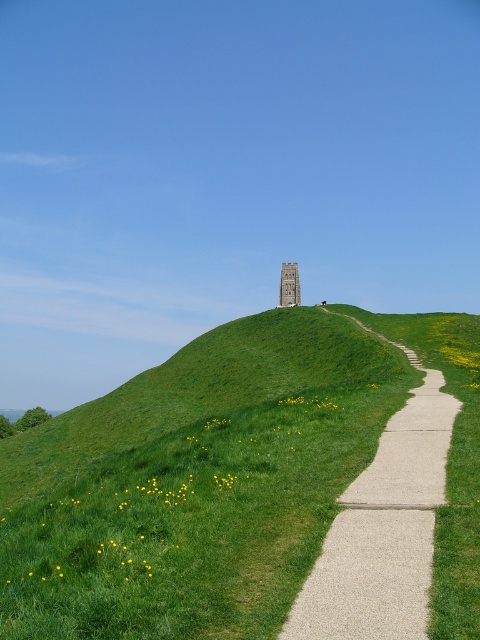
Question: Can you confirm if green grassy hill at center is bigger than stone tower at center?

Choices:
 (A) yes
 (B) no

Answer: (A)

Question: Among these points, which one is farthest from the camera?

Choices:
 (A) (432, 468)
 (B) (475, 600)

Answer: (A)

Question: Is light gray gravel path at center thinner than stone tower at center?

Choices:
 (A) yes
 (B) no

Answer: (B)

Question: Considering the real-world distances, which object is closest to the light gray gravel path at center?

Choices:
 (A) stone tower at center
 (B) green grassy hill at center

Answer: (B)

Question: Does light gray gravel path at center appear under stone tower at center?

Choices:
 (A) no
 (B) yes

Answer: (B)

Question: Considering the real-world distances, which object is closest to the stone tower at center?

Choices:
 (A) light gray gravel path at center
 (B) green grassy hill at center

Answer: (B)